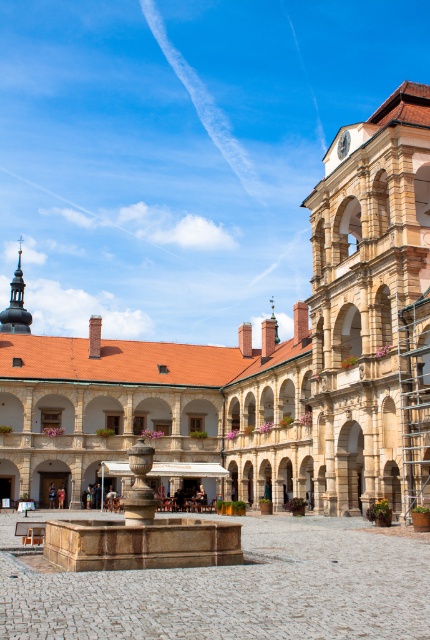
Question: Can you confirm if beige stone palace at center is thinner than marble fountain at center?

Choices:
 (A) no
 (B) yes

Answer: (A)

Question: Does beige stone palace at center come behind marble fountain at center?

Choices:
 (A) no
 (B) yes

Answer: (B)

Question: Is beige stone palace at center wider than marble fountain at center?

Choices:
 (A) no
 (B) yes

Answer: (B)

Question: Which object appears farthest from the camera in this image?

Choices:
 (A) marble fountain at center
 (B) beige stone palace at center

Answer: (B)

Question: Among these points, which one is farthest from the camera?

Choices:
 (A) (85, 438)
 (B) (138, 445)

Answer: (A)